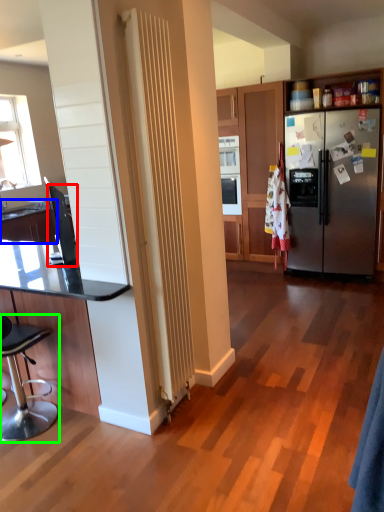
Question: Based on their relative distances, which object is farther from appliance (highlighted by a red box)? Choose from countertop (highlighted by a blue box) and chair (highlighted by a green box).

Choices:
 (A) countertop
 (B) chair

Answer: (B)